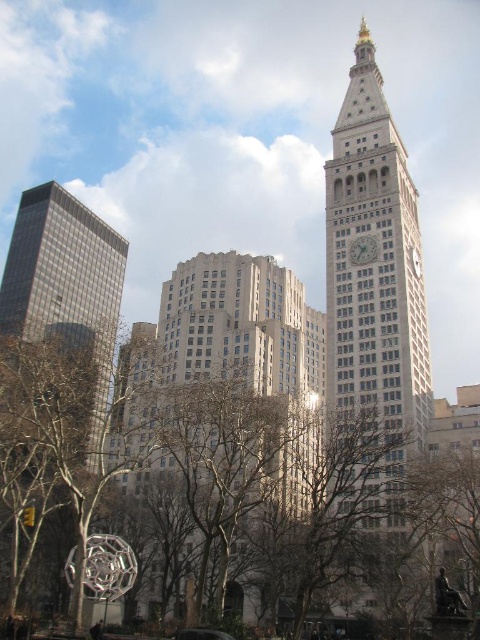
Between brown leafless tree at center and white stone clock at center, which one is positioned lower?

Positioned lower is brown leafless tree at center.

Does brown leafless tree at center have a lesser height compared to white stone clock at center?

In fact, brown leafless tree at center may be taller than white stone clock at center.

At what (x,y) coordinates should I click in order to perform the action: click on brown leafless tree at center. Please return your answer as a coordinate pair (x, y). The image size is (480, 640). Looking at the image, I should click on (242, 474).

Is brown leafless tree at lower left bigger than white stone clock at center?

Yes, brown leafless tree at lower left is bigger than white stone clock at center.

Locate an element on the screen. The height and width of the screenshot is (640, 480). brown leafless tree at lower left is located at coordinates (74, 420).

Who is positioned more to the left, gold-plated stone clock tower at center or metallic green car at center?

metallic green car at center is more to the left.

Describe the element at coordinates (375, 273) in the screenshot. The width and height of the screenshot is (480, 640). I see `gold-plated stone clock tower at center` at that location.

Who is more forward, (x=355, y=84) or (x=183, y=636)?

Point (x=183, y=636) is more forward.

Find the location of a particular element. This screenshot has width=480, height=640. gold-plated stone clock tower at center is located at coordinates (375, 273).